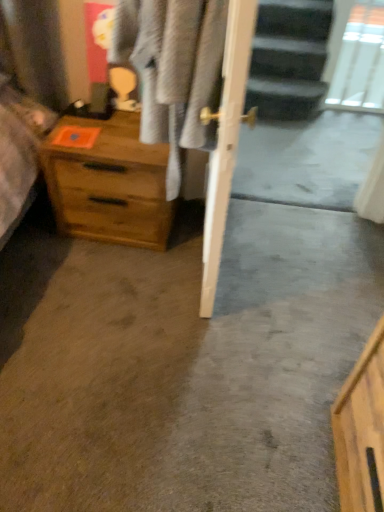
The image size is (384, 512). Identify the location of empty space that is ontop of wooden chest of drawers at left (from a real-world perspective). (110, 127).